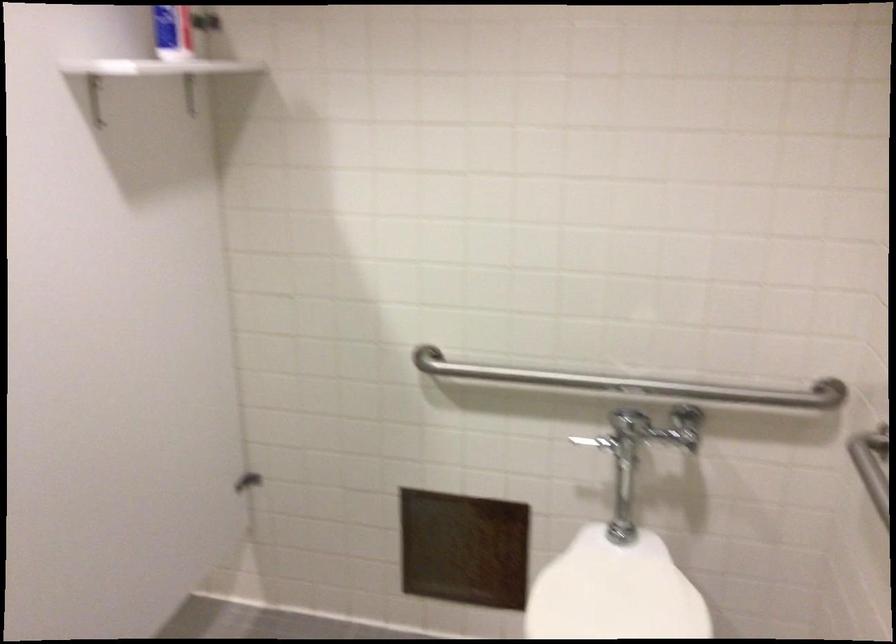
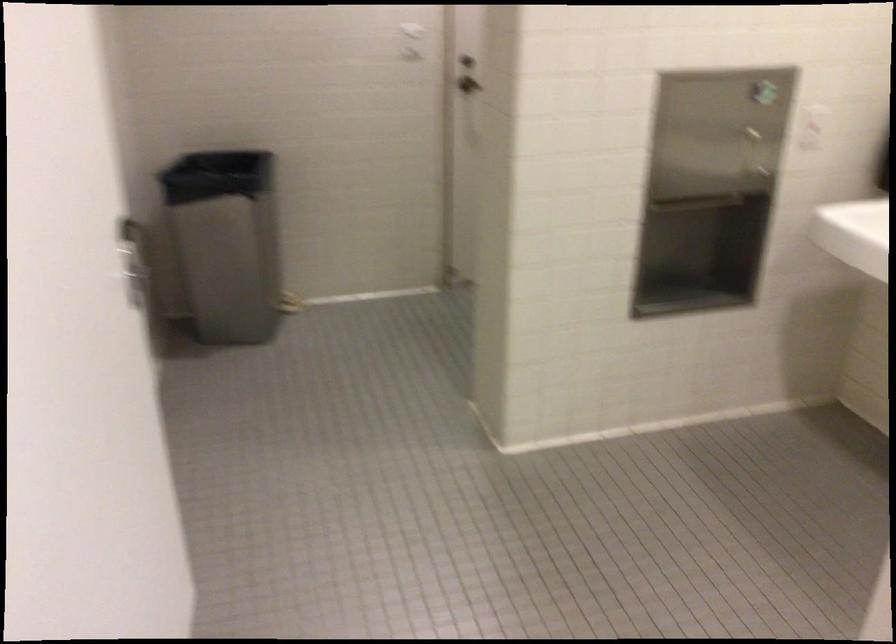
Question: Based on the continuous images, in which direction is the camera rotating? Reply with the corresponding letter.

Choices:
 (A) Left
 (B) Right
 (C) Up
 (D) Down

Answer: (A)